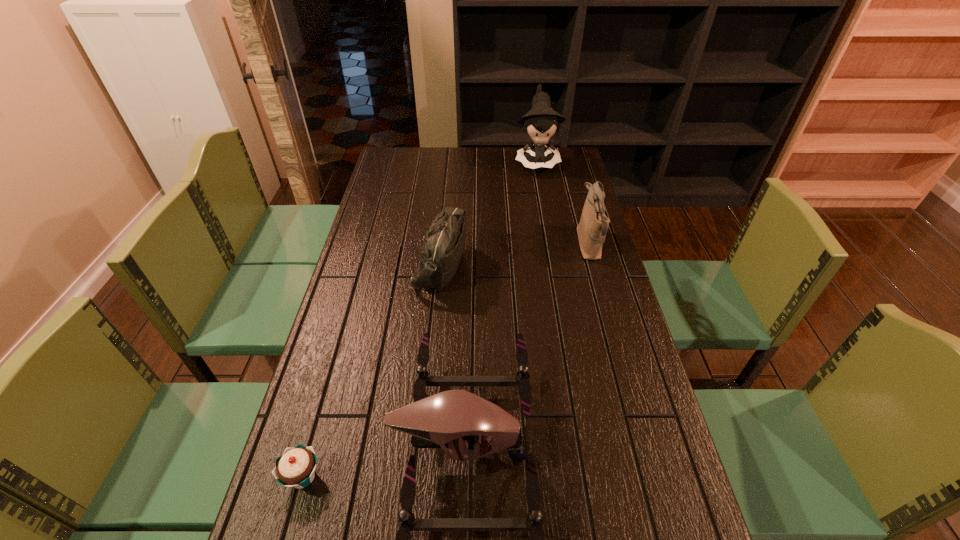
The image size is (960, 540). I want to click on the farthest object, so click(x=540, y=123).

Where is `doll`? This screenshot has width=960, height=540. doll is located at coordinates (540, 123).

The width and height of the screenshot is (960, 540). What are the coordinates of `the right shoulder bag` in the screenshot? It's located at (592, 228).

Find the location of `the left shoulder bag`. the left shoulder bag is located at coordinates (442, 249).

You are a GUI agent. You are given a task and a screenshot of the screen. Output one action in this format:
    pyautogui.click(x=<x>, y=<y>)
    Task: Click on the cupcake
    This screenshot has height=540, width=960.
    Given the screenshot: What is the action you would take?
    pyautogui.click(x=295, y=468)

Where is `the leftmost object`? Image resolution: width=960 pixels, height=540 pixels. the leftmost object is located at coordinates (295, 468).

The width and height of the screenshot is (960, 540). What are the coordinates of `free space located 0.140m at the face of the tallest object` in the screenshot? It's located at (543, 198).

The width and height of the screenshot is (960, 540). I want to click on vacant space located 0.240m on the front-facing side of the right shoulder bag, so point(507,245).

Locate an element on the screen. free location located on the front-facing side of the right shoulder bag is located at coordinates [x=521, y=245].

You are a GUI agent. You are given a task and a screenshot of the screen. Output one action in this format:
    pyautogui.click(x=<x>, y=<y>)
    Task: Click on the free space located on the front-facing side of the right shoulder bag
    The height and width of the screenshot is (540, 960).
    Given the screenshot: What is the action you would take?
    pyautogui.click(x=464, y=245)